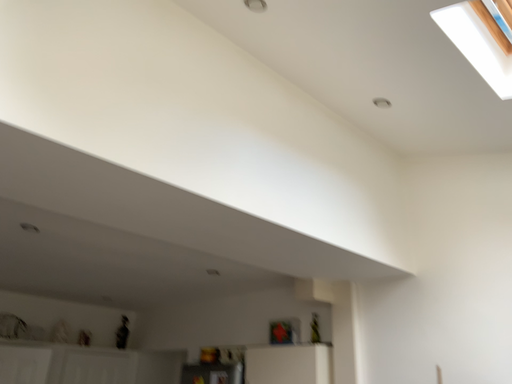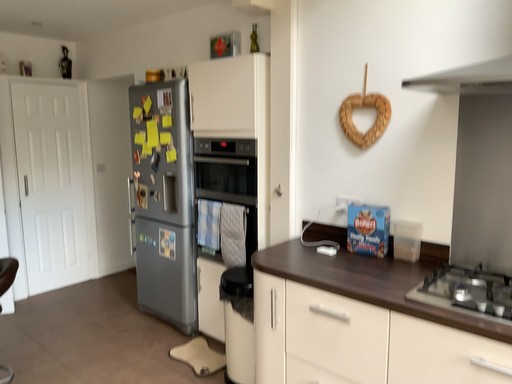
Question: Which way did the camera rotate in the video?

Choices:
 (A) rotated upward
 (B) rotated downward

Answer: (B)